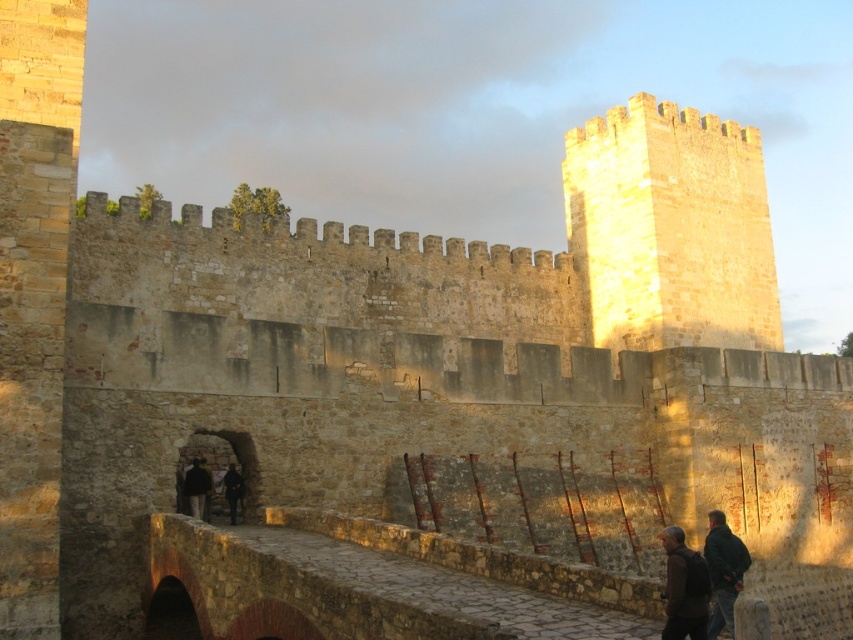
You are a knight standing at the base of the tower. You need to retrieve your dark brown leather jacket at center but there is a dark brown leather jacket at lower right blocking your path. Can you reach the jacket at center without stepping over the one at lower right?

The dark brown leather jacket at lower right is 59.83 feet away from dark brown leather jacket at center. Since the distance between them is quite large, you can easily walk around the jacket at lower right to reach the one at center without needing to step over it.

You are standing at the base of the tower in the image. You need to place a small decorative stone at the same 2D location as the dark green jacket at lower right. What are the coordinates where you should place the stone?

The coordinates for placing the decorative stone should be at point (723, 572), matching the 2D location of the dark green jacket at lower right.